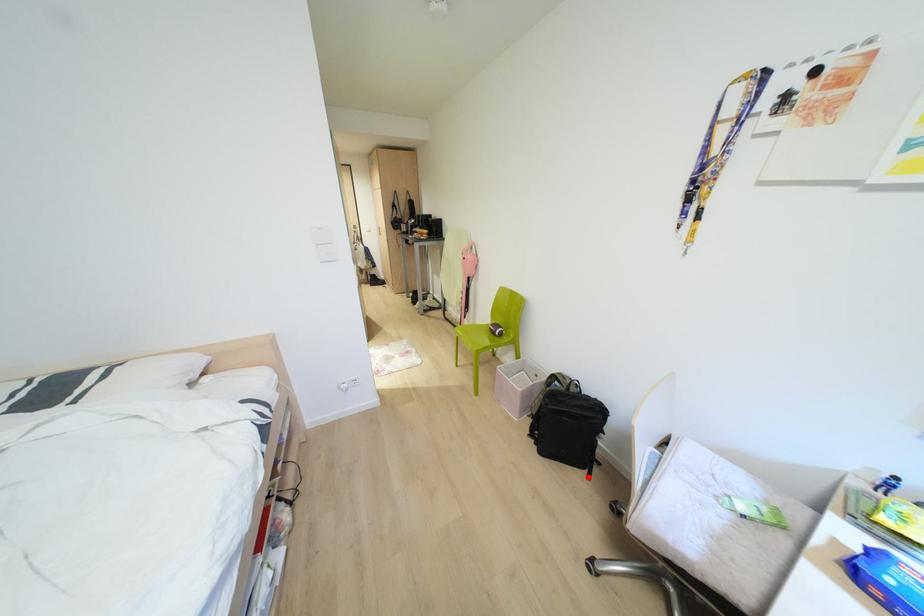
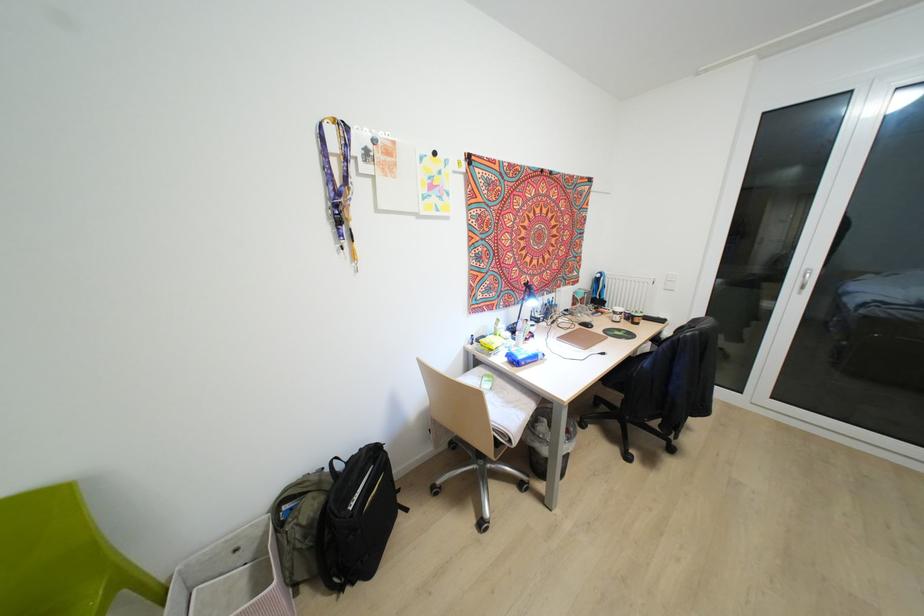
Locate, in the second image, the point that corresponds to the highlighted location in the first image.

(406, 509)